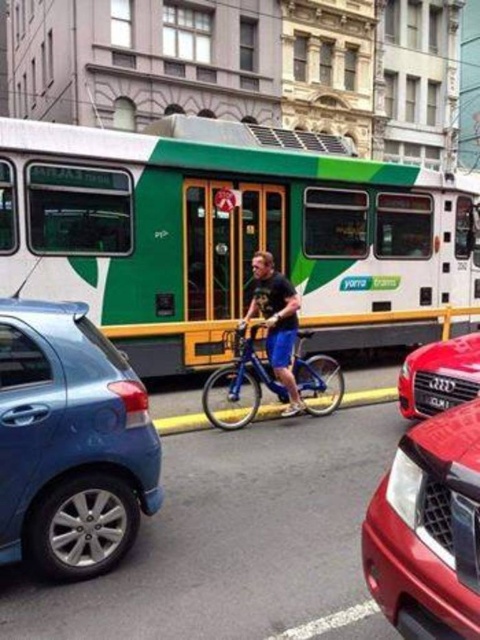
You are a photographer trying to capture a clear shot of the matte black shirt at center and the black plastic license plate at center. Since you want both subjects to be in focus, you need to adjust your camera settings based on their sizes. Which object should you prioritize focusing on first to ensure proper depth of field?

The matte black shirt at center has a larger width than the black plastic license plate at center. To ensure both are in focus, you should prioritize focusing on the matte black shirt at center first since it is larger and requires more attention in the depth of field.

Looking at this image, where is the shiny red audi at center located in the image?

The shiny red audi at center is located at point (439, 376) in the image.

You are a delivery person standing at the edge of the sidewalk. You need to place a package on the ground between the matte black shirt at center and the black plastic license plate at center. Can you fit the package there if it requires 6 feet of space?

The distance between the matte black shirt at center and the black plastic license plate at center is 5.78 feet, which is less than the required 6 feet. Therefore, the package cannot be placed there.